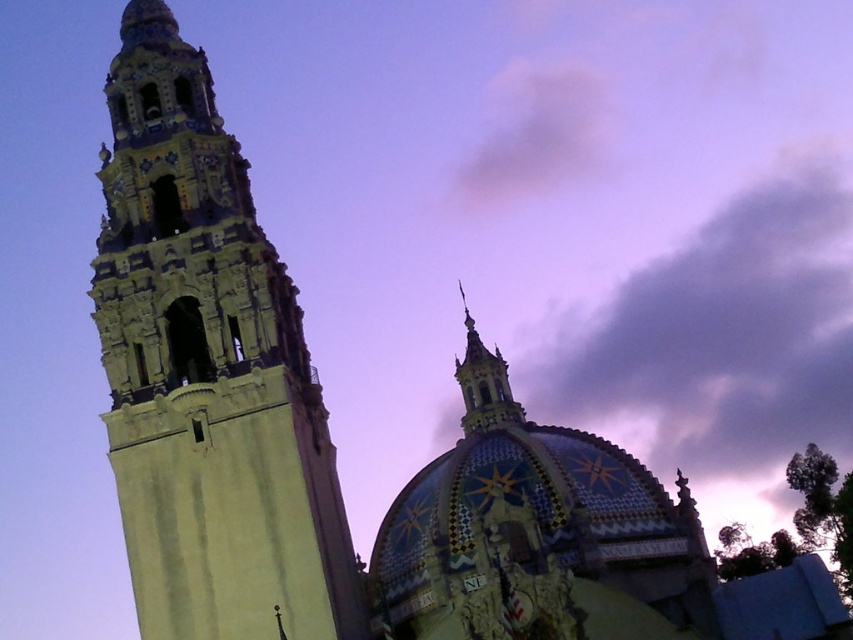
You are an architect planning to install a decorative light between the light beige stone tower at left and the gray fluffy cloud at upper center. The light has a maximum reach of 50 meters. Will the light be able to illuminate both objects?

The distance between the light beige stone tower at left and the gray fluffy cloud at upper center is 52.47 meters. Since the light can only reach 50 meters, it will not be able to illuminate both objects simultaneously.

You are standing in the twilight scene and want to take a photo of the light beige stone tower at left and the gray fluffy cloud at upper center. Which object will appear larger in the photo?

The light beige stone tower at left will appear larger in the photo because it is closer to the viewer than the gray fluffy cloud at upper center.